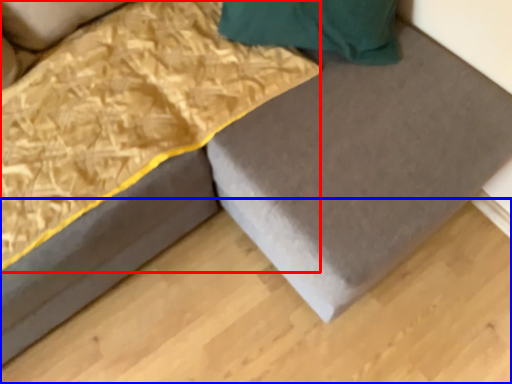
Question: Which of the following is the farthest to the observer, blanket (highlighted by a red box) or plywood (highlighted by a blue box)?

Choices:
 (A) blanket
 (B) plywood

Answer: (B)